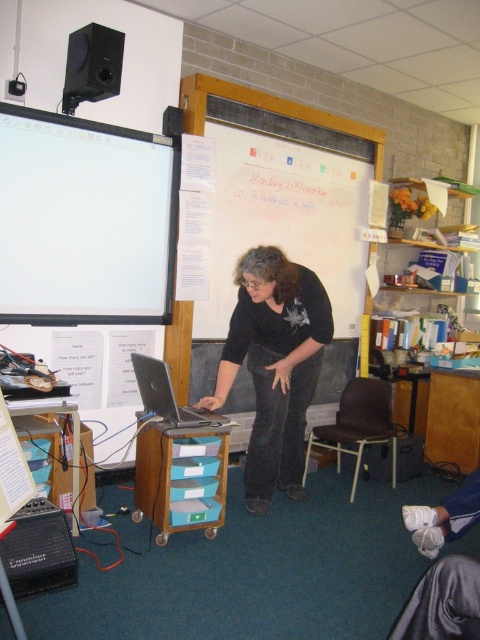
Is black matte/black jeans at center above silver metallic laptop at center?

No.

You are a GUI agent. You are given a task and a screenshot of the screen. Output one action in this format:
    pyautogui.click(x=<x>, y=<y>)
    Task: Click on the black matte/black jeans at center
    This screenshot has height=640, width=480.
    Given the screenshot: What is the action you would take?
    pyautogui.click(x=275, y=365)

Does whiteboard at upper center appear on the left side of black matte/black jeans at center?

Incorrect, whiteboard at upper center is not on the left side of black matte/black jeans at center.

The image size is (480, 640). What do you see at coordinates (284, 195) in the screenshot?
I see `whiteboard at upper center` at bounding box center [284, 195].

You are a GUI agent. You are given a task and a screenshot of the screen. Output one action in this format:
    pyautogui.click(x=<x>, y=<y>)
    Task: Click on the whiteboard at upper center
    The width and height of the screenshot is (480, 640).
    Given the screenshot: What is the action you would take?
    pyautogui.click(x=284, y=195)

Can you confirm if whiteboard at upper center is taller than black matte speaker at upper left?

Yes, whiteboard at upper center is taller than black matte speaker at upper left.

Between whiteboard at upper center and black matte speaker at upper left, which one appears on the right side from the viewer's perspective?

Positioned to the right is whiteboard at upper center.

Does point (216, 339) come closer to viewer compared to point (108, 68)?

No, it is not.

The image size is (480, 640). Find the location of `whiteboard at upper center`. whiteboard at upper center is located at coordinates (284, 195).